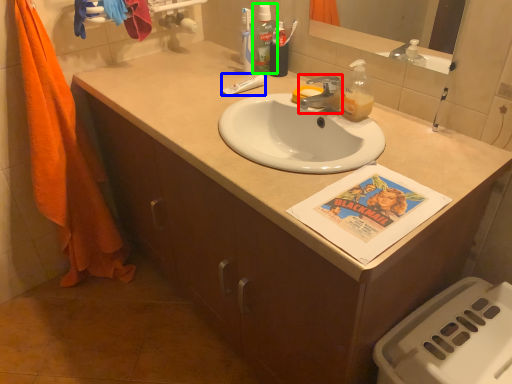
Question: Based on their relative distances, which object is nearer to faucet (highlighted by a red box)? Choose from toothpaste (highlighted by a blue box) and mouthwash (highlighted by a green box).

Choices:
 (A) toothpaste
 (B) mouthwash

Answer: (A)